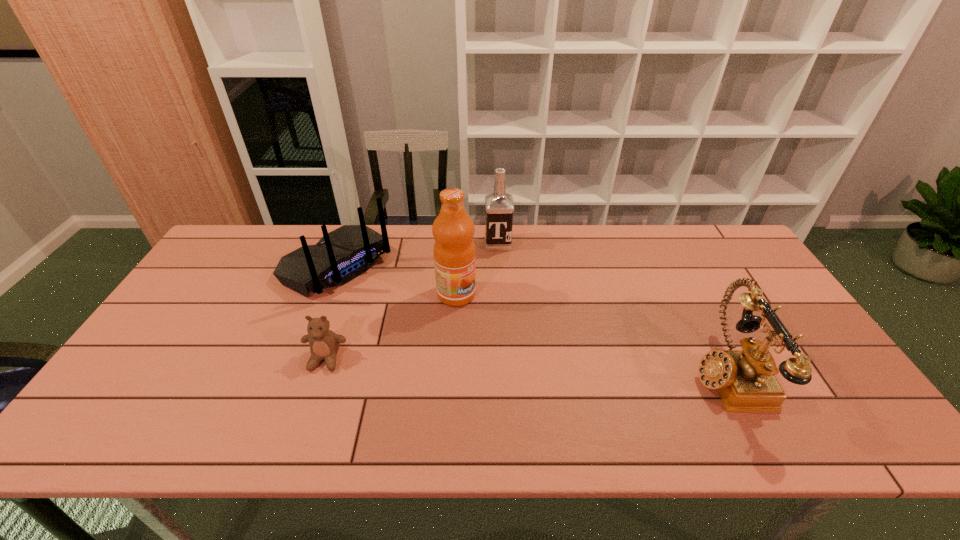
Find the location of a particular element. vacant space that is in between the router and the teddy bear is located at coordinates (332, 312).

The width and height of the screenshot is (960, 540). Find the location of `vacant area that lies between the tallest object and the telephone`. vacant area that lies between the tallest object and the telephone is located at coordinates (590, 333).

Image resolution: width=960 pixels, height=540 pixels. I want to click on free area in between the third object from left to right and the shortest object, so click(x=391, y=327).

You are a GUI agent. You are given a task and a screenshot of the screen. Output one action in this format:
    pyautogui.click(x=<x>, y=<y>)
    Task: Click on the free spot between the shortest object and the tallest object
    The image size is (960, 540).
    Given the screenshot: What is the action you would take?
    pyautogui.click(x=391, y=327)

Locate an element on the screen. Image resolution: width=960 pixels, height=540 pixels. free space between the third object from left to right and the rightmost object is located at coordinates (590, 333).

The image size is (960, 540). Find the location of `vacant space in between the router and the second object from right to left`. vacant space in between the router and the second object from right to left is located at coordinates (419, 254).

Where is `object that is the third closest to the router`? The height and width of the screenshot is (540, 960). object that is the third closest to the router is located at coordinates (499, 205).

Identify the location of object that is the fourth closest to the fourth object from left to right. (324, 344).

This screenshot has height=540, width=960. I want to click on free location that satisfies the following two spatial constraints: 1. on the front-facing side of the teddy bear; 2. on the dial number of the telephone, so click(322, 372).

You are a GUI agent. You are given a task and a screenshot of the screen. Output one action in this format:
    pyautogui.click(x=<x>, y=<y>)
    Task: Click on the vacant space that satisfies the following two spatial constraints: 1. on the front side of the telephone; 2. on the dial number of the tallest object
    The height and width of the screenshot is (540, 960).
    Given the screenshot: What is the action you would take?
    coord(452,372)